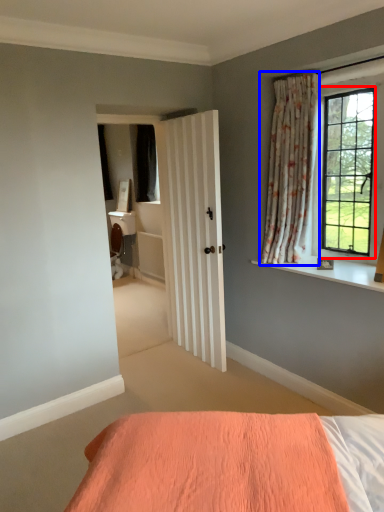
Question: Among these objects, which one is farthest to the camera, window (highlighted by a red box) or curtain (highlighted by a blue box)?

Choices:
 (A) window
 (B) curtain

Answer: (B)